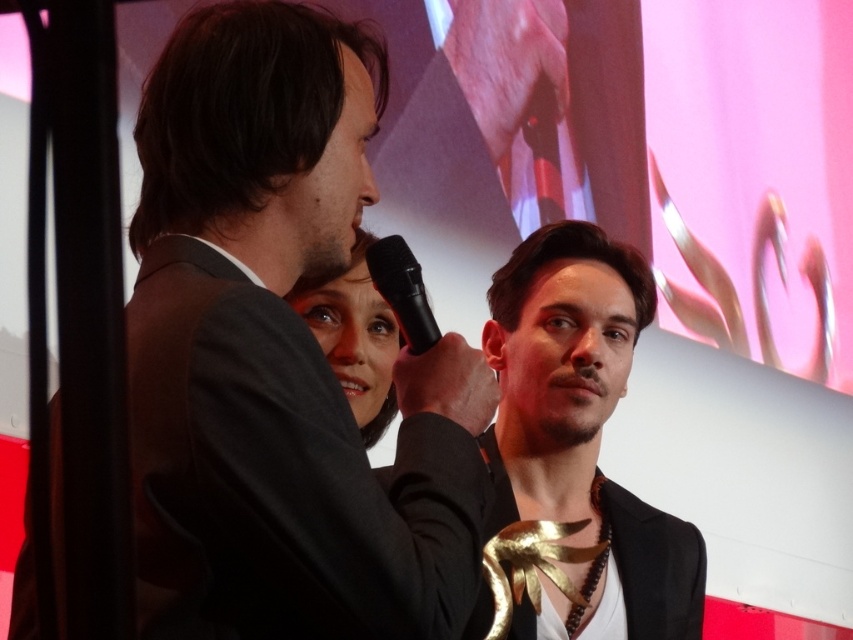
Question: Is black matte suit at center to the right of gold metallic jacket at center from the viewer's perspective?

Choices:
 (A) no
 (B) yes

Answer: (A)

Question: Which of these objects is positioned closest to the shiny black jacket at center?

Choices:
 (A) matte black microphone at center
 (B) black matte suit at center
 (C) black plastic microphone at center

Answer: (A)

Question: Among these objects, which one is farthest from the camera?

Choices:
 (A) matte black microphone at center
 (B) black plastic microphone at center
 (C) gold metallic jacket at center

Answer: (C)

Question: Is matte black microphone at center positioned before black plastic microphone at center?

Choices:
 (A) yes
 (B) no

Answer: (B)

Question: Which object appears closest to the camera in this image?

Choices:
 (A) shiny black jacket at center
 (B) matte black microphone at center
 (C) black matte suit at center
 (D) black plastic microphone at center

Answer: (C)

Question: In this image, where is black matte suit at center located relative to matte black microphone at center?

Choices:
 (A) left
 (B) right

Answer: (A)